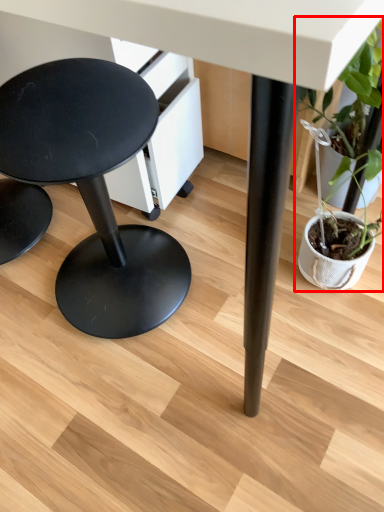
Question: Where is houseplant (annotated by the red box) located in relation to stool in the image?

Choices:
 (A) right
 (B) left

Answer: (A)